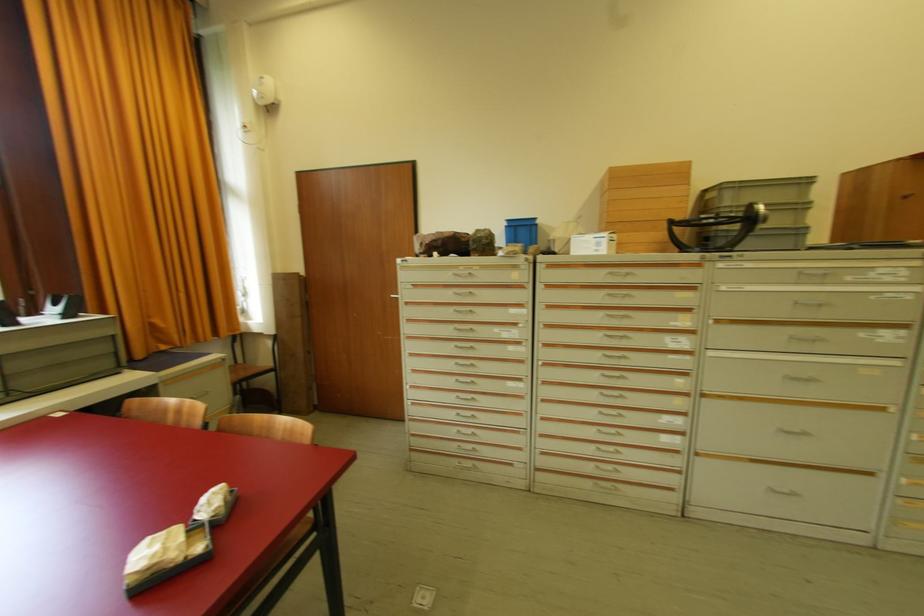
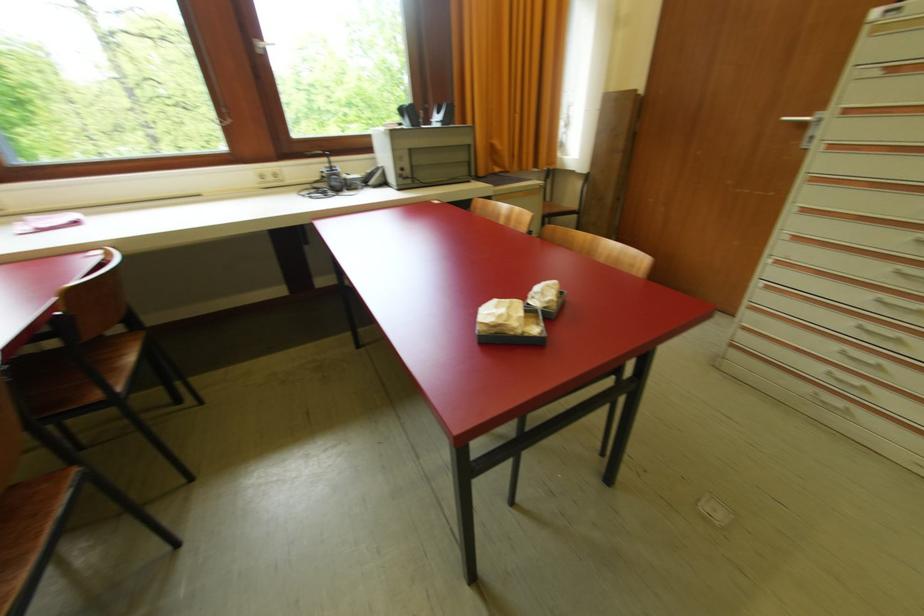
The images are taken continuously from a first-person perspective. In which direction is your viewpoint rotating?

The camera rotated toward left-down.